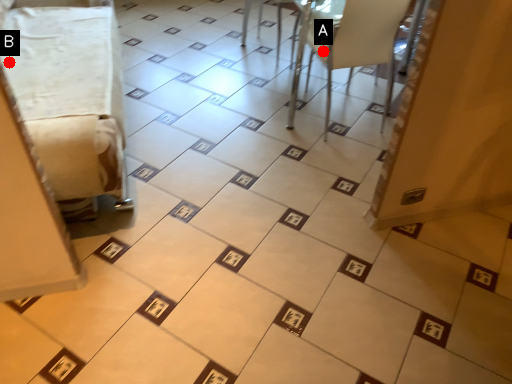
Question: Two points are circled on the image, labeled by A and B beside each circle. Which point is closer to the camera?

Choices:
 (A) A is closer
 (B) B is closer

Answer: (B)